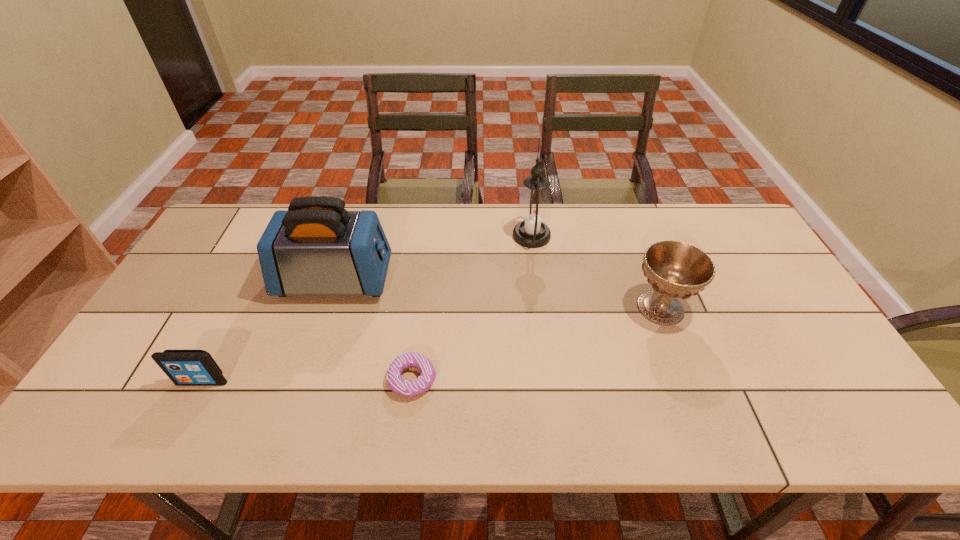
You are a GUI agent. You are given a task and a screenshot of the screen. Output one action in this format:
    pyautogui.click(x=<x>, y=<y>)
    Task: Click on the farthest object
    The image size is (960, 540).
    Given the screenshot: What is the action you would take?
    pyautogui.click(x=534, y=211)

Where is `the tallest object`? This screenshot has height=540, width=960. the tallest object is located at coordinates (534, 211).

The width and height of the screenshot is (960, 540). Find the location of `the second tallest object`. the second tallest object is located at coordinates (316, 247).

At what (x,y) coordinates should I click in order to perform the action: click on the second object from left to right. Please return your answer as a coordinate pair (x, y). Looking at the image, I should click on (316, 247).

The image size is (960, 540). In order to click on the rightmost object in this screenshot , I will do `click(674, 269)`.

Find the location of a particular element. The image size is (960, 540). the third shortest object is located at coordinates [674, 269].

You are a GUI agent. You are given a task and a screenshot of the screen. Output one action in this format:
    pyautogui.click(x=<x>, y=<y>)
    Task: Click on the iPod
    
    Given the screenshot: What is the action you would take?
    pyautogui.click(x=184, y=367)

Where is `the leftmost object`? the leftmost object is located at coordinates (184, 367).

You are a GUI agent. You are given a task and a screenshot of the screen. Output one action in this format:
    pyautogui.click(x=<x>, y=<y>)
    Task: Click on the doughnut
    
    Given the screenshot: What is the action you would take?
    pyautogui.click(x=405, y=388)

You are a GUI agent. You are given a task and a screenshot of the screen. Output one action in this format:
    pyautogui.click(x=<x>, y=<y>)
    Task: Click on the shortest object
    The height and width of the screenshot is (540, 960).
    Given the screenshot: What is the action you would take?
    pyautogui.click(x=405, y=388)